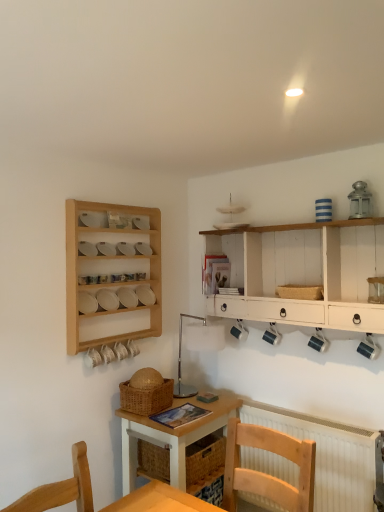
In order to face white wood shelf at upper right, should I rotate leftwards or rightwards?

Rotate your view right by about 12.507°.

The width and height of the screenshot is (384, 512). What do you see at coordinates (146, 398) in the screenshot? I see `woven brown basket at center, placed as the 2th basket when sorted from right to left` at bounding box center [146, 398].

What is the approximate width of woven straw basket at upper center, marked as the 1th basket in a right-to-left arrangement?

It is 7.54 inches.

Locate an element on the screen. This screenshot has width=384, height=512. wooden chair at lower center is located at coordinates (265, 473).

Where is `white wood shelf at upper right`? white wood shelf at upper right is located at coordinates (303, 273).

Is wooden chair at lower center situated inside woven brown basket at center, the 2th basket in the top-to-bottom sequence, or outside?

wooden chair at lower center cannot be found inside woven brown basket at center, the 2th basket in the top-to-bottom sequence.

Does wooden chair at lower center have a lesser width compared to woven brown basket at center, acting as the first basket starting from the bottom?

No.

Is point (272, 480) more distant than point (153, 409)?

That is False.

Considering the sizes of objects white textured radiator at lower right and wooden chair at lower center in the image provided, who is thinner, white textured radiator at lower right or wooden chair at lower center?

white textured radiator at lower right.

Is the position of white textured radiator at lower right more distant than that of wooden chair at lower center?

Yes, the depth of white textured radiator at lower right is greater than that of wooden chair at lower center.

Is white textured radiator at lower right inside the boundaries of wooden chair at lower center, or outside?

white textured radiator at lower right is spatially situated outside wooden chair at lower center.

From the picture: Can you confirm if white textured radiator at lower right is shorter than wooden chair at lower center?

In fact, white textured radiator at lower right may be taller than wooden chair at lower center.

From a real-world perspective, is wooden chair at lower center physically below light wood desk at center?

No.

Is wooden chair at lower center oriented away from light wood desk at center?

No, light wood desk at center is not at the back of wooden chair at lower center.

Is the depth of wooden chair at lower center less than that of light wood desk at center?

Yes.

In terms of width, does wooden chair at lower center look wider or thinner when compared to light wood desk at center?

wooden chair at lower center is wider than light wood desk at center.

Considering the positions of objects white wood shelf at upper right and white textured radiator at lower right in the image provided, who is in front, white wood shelf at upper right or white textured radiator at lower right?

white wood shelf at upper right is closer to the camera.

How many degrees apart are the facing directions of white wood shelf at upper right and white textured radiator at lower right?

The angular difference between white wood shelf at upper right and white textured radiator at lower right is 0.362 degrees.

Measure the distance from white wood shelf at upper right to white textured radiator at lower right.

white wood shelf at upper right and white textured radiator at lower right are 31.03 inches apart from each other.

Considering the points (355, 272) and (341, 471), which point is in front, point (355, 272) or point (341, 471)?

The point (341, 471) is closer to the camera.

How different are the orientations of white wood shelf at upper right and wooden shelf at left in degrees?

The angle between the facing direction of white wood shelf at upper right and the facing direction of wooden shelf at left is 89.3 degrees.

Is white wood shelf at upper right turned away from wooden shelf at left?

No, wooden shelf at left is not at the back of white wood shelf at upper right.

I want to click on shelf above the white wood shelf at upper right (from a real-world perspective), so click(108, 274).

From the image's perspective, is white wood shelf at upper right positioned above or below wooden shelf at left?

Based on their image positions, white wood shelf at upper right is located beneath wooden shelf at left.

From the image's perspective, which one is positioned lower, light wood desk at center or wooden shelf at left?

light wood desk at center.

Looking at this image, from a real-world perspective, is light wood desk at center positioned above or below wooden shelf at left?

From a real-world perspective, light wood desk at center is physically below wooden shelf at left.

Is light wood desk at center positioned with its back to wooden shelf at left?

No, light wood desk at center is not facing away from wooden shelf at left.

Is the surface of light wood desk at center in direct contact with wooden shelf at left?

light wood desk at center and wooden shelf at left are not in contact.

Is the position of wooden shelf at left less distant than that of woven brown basket at center, placed as the 2th basket when sorted from right to left?

Yes, it is.

From the picture: From the image's perspective, is wooden shelf at left located beneath woven brown basket at center, acting as the first basket starting from the bottom?

No, from the image's perspective, wooden shelf at left is not beneath woven brown basket at center, acting as the first basket starting from the bottom.

Is wooden shelf at left facing towards woven brown basket at center, the 2th basket in the top-to-bottom sequence?

No, wooden shelf at left is not facing towards woven brown basket at center, the 2th basket in the top-to-bottom sequence.

This screenshot has height=512, width=384. Find the location of `chair lying below the woven brown basket at center, acting as the first basket starting from the bottom (from the image's perspective)`. chair lying below the woven brown basket at center, acting as the first basket starting from the bottom (from the image's perspective) is located at coordinates (265, 473).

This screenshot has width=384, height=512. I want to click on radiator below the wooden chair at lower center (from a real-world perspective), so click(328, 455).

Based on their spatial positions, is white wood shelf at upper right or light wood desk at center closer to wooden chair at lower center?

Based on the image, light wood desk at center appears to be nearer to wooden chair at lower center.

Looking at this image, when comparing their distances from woven brown basket at center, placed as the 2th basket when sorted from right to left, does light wood desk at center or woven straw basket at upper center, placed as the second basket when sorted from left to right, seem further?

Based on the image, woven straw basket at upper center, placed as the second basket when sorted from left to right, appears to be further to woven brown basket at center, placed as the 2th basket when sorted from right to left.

Based on their spatial positions, is wooden chair at lower center or wooden shelf at left further from light wood desk at center?

wooden shelf at left is further to light wood desk at center.

Considering their positions, is woven brown basket at center, the 2th basket in the top-to-bottom sequence, positioned closer to woven straw basket at upper center, the 1th basket from the top, than wooden shelf at left?

woven brown basket at center, the 2th basket in the top-to-bottom sequence, is positioned closer to the anchor woven straw basket at upper center, the 1th basket from the top.

Looking at the image, which one is located further to white textured radiator at lower right, woven brown basket at center, placed as the 2th basket when sorted from right to left, or wooden chair at lower center?

→ woven brown basket at center, placed as the 2th basket when sorted from right to left.

Based on their spatial positions, is wooden shelf at left or woven brown basket at center, positioned as the 1th basket in left-to-right order, further from light wood desk at center?

wooden shelf at left lies further to light wood desk at center than the other object.

When comparing their distances from woven brown basket at center, positioned as the 1th basket in left-to-right order, does light wood desk at center or wooden chair at lower center seem further?

wooden chair at lower center lies further to woven brown basket at center, positioned as the 1th basket in left-to-right order, than the other object.

From the image, which object appears to be farther from woven straw basket at upper center, marked as the 1th basket in a right-to-left arrangement, wooden shelf at left or white wood shelf at upper right?

wooden shelf at left is positioned further to the anchor woven straw basket at upper center, marked as the 1th basket in a right-to-left arrangement.

Locate an element on the screen. The width and height of the screenshot is (384, 512). basket that lies between woven straw basket at upper center, marked as the 1th basket in a right-to-left arrangement, and light wood desk at center from top to bottom is located at coordinates (146, 398).

Identify the location of basket between wooden shelf at left and white wood shelf at upper right in the horizontal direction. pyautogui.click(x=146, y=398).

Image resolution: width=384 pixels, height=512 pixels. What are the coordinates of `radiator between wooden chair at lower center and light wood desk at center along the z-axis` in the screenshot? It's located at (328, 455).

Identify the location of chair between wooden shelf at left and light wood desk at center vertically. (265, 473).